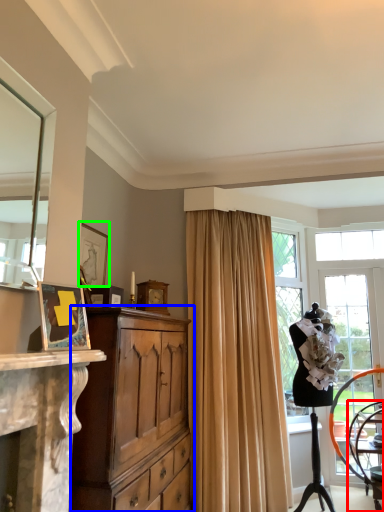
Question: Which object is the closest to the chair (highlighted by a red box)? Choose among these: cabinetry (highlighted by a blue box) or picture frame (highlighted by a green box).

Choices:
 (A) cabinetry
 (B) picture frame

Answer: (A)